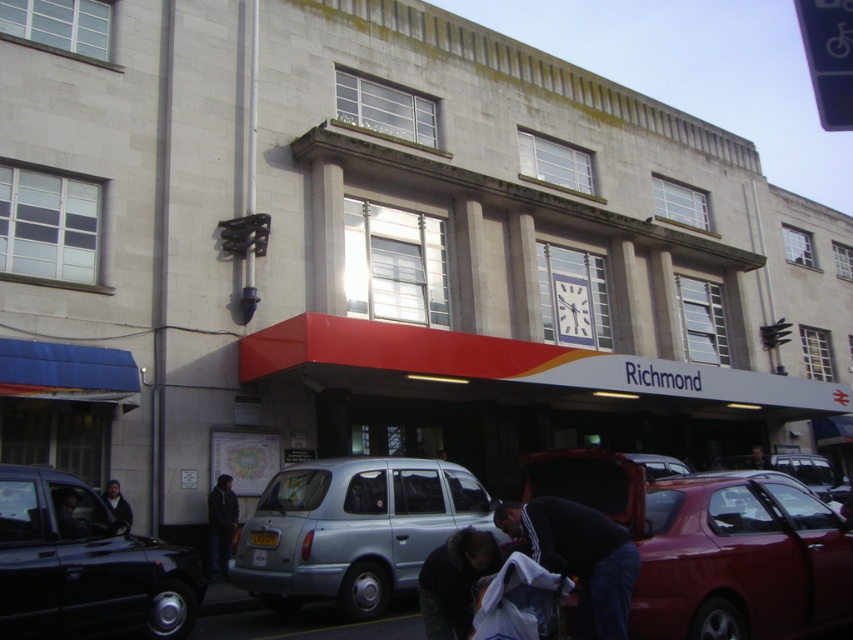
Question: Considering the relative positions of dark brown fur coat at lower center and metallic red car at center in the image provided, where is dark brown fur coat at lower center located with respect to metallic red car at center?

Choices:
 (A) right
 (B) left

Answer: (B)

Question: Among these points, which one is nearest to the camera?

Choices:
 (A) (444, 589)
 (B) (125, 566)

Answer: (A)

Question: Does light blue metallic taxi at center have a larger size compared to matte black car door at lower left?

Choices:
 (A) yes
 (B) no

Answer: (A)

Question: Which of the following is the farthest from the observer?

Choices:
 (A) matte black car door at lower left
 (B) dark blue jacket at lower left
 (C) dark blue fabric at lower center

Answer: (B)

Question: Based on their relative distances, which object is farther from the dark blue jacket at center?

Choices:
 (A) shiny red car at lower right
 (B) dark blue fabric at lower center
 (C) dark blue jacket at lower left

Answer: (B)

Question: Can you confirm if light blue metallic taxi at center is wider than dark blue jacket at center?

Choices:
 (A) yes
 (B) no

Answer: (A)